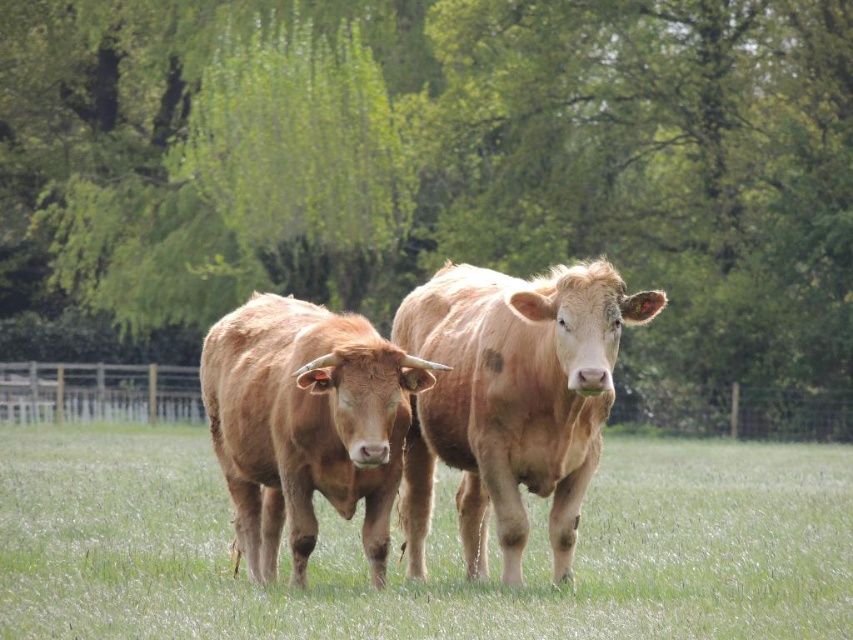
Which is above, green grass at center or light brown smooth cow at center?

light brown smooth cow at center

Is green grass at center further to camera compared to light brown smooth cow at center?

No, green grass at center is closer to the viewer.

Locate an element on the screen. The height and width of the screenshot is (640, 853). green grass at center is located at coordinates (428, 548).

Is light brown smooth cow at center thinner than light brown textured cow at center?

Yes.

Which of these two, light brown smooth cow at center or light brown textured cow at center, stands taller?

light brown smooth cow at center

Between point (577, 452) and point (236, 358), which one is positioned in front?

Point (577, 452)

Identify the location of light brown smooth cow at center. (511, 400).

Between point (498, 173) and point (381, 378), which one is positioned behind?

Point (498, 173)

Is green leafy tree at center in front of light brown textured cow at center?

No, it is not.

Identify the location of green leafy tree at center. (440, 176).